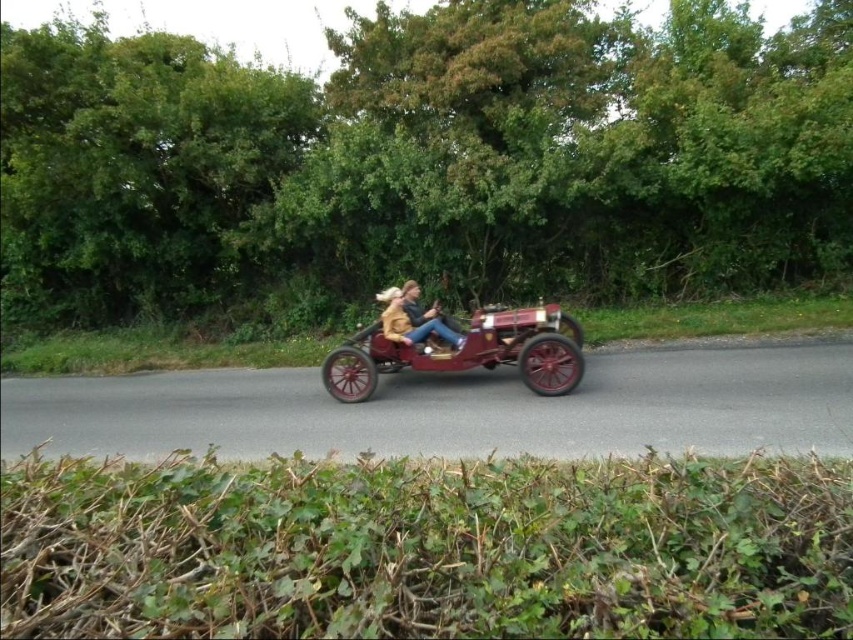
Question: Can you confirm if maroon polished wood sidecar at center is thinner than leather jacket at center?

Choices:
 (A) no
 (B) yes

Answer: (A)

Question: Can you confirm if maroon polished wood sidecar at center is positioned above leather jacket at center?

Choices:
 (A) no
 (B) yes

Answer: (A)

Question: Does maroon polished wood sidecar at center have a larger size compared to leather jacket at center?

Choices:
 (A) no
 (B) yes

Answer: (B)

Question: Which object appears farthest from the camera in this image?

Choices:
 (A) maroon polished wood sidecar at center
 (B) leather jacket at center

Answer: (B)